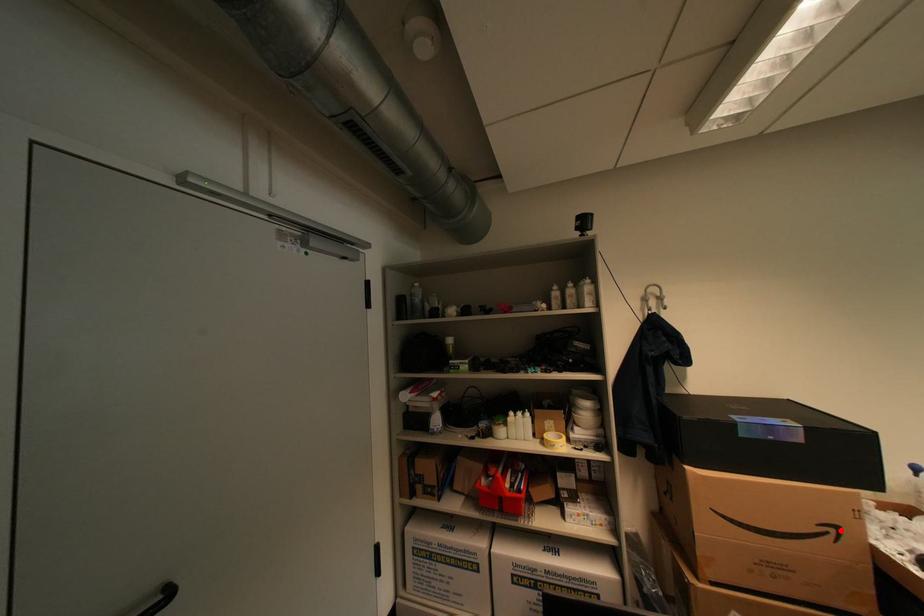
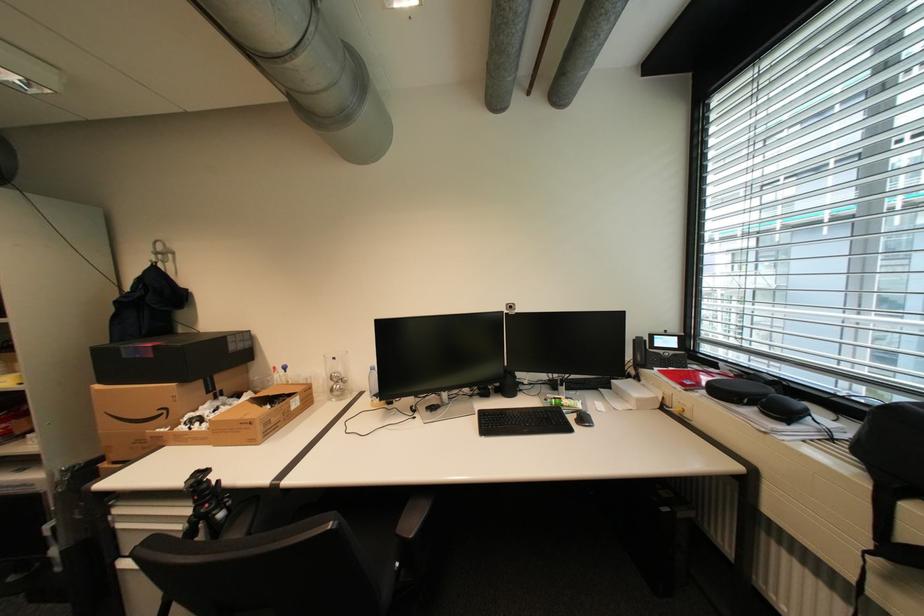
Question: I am providing you with two images of the same scene from different viewpoints. A red point is shown in image1. For the corresponding object point in image2, is it positioned nearer or farther from the camera?

Choices:
 (A) Nearer
 (B) Farther

Answer: (B)